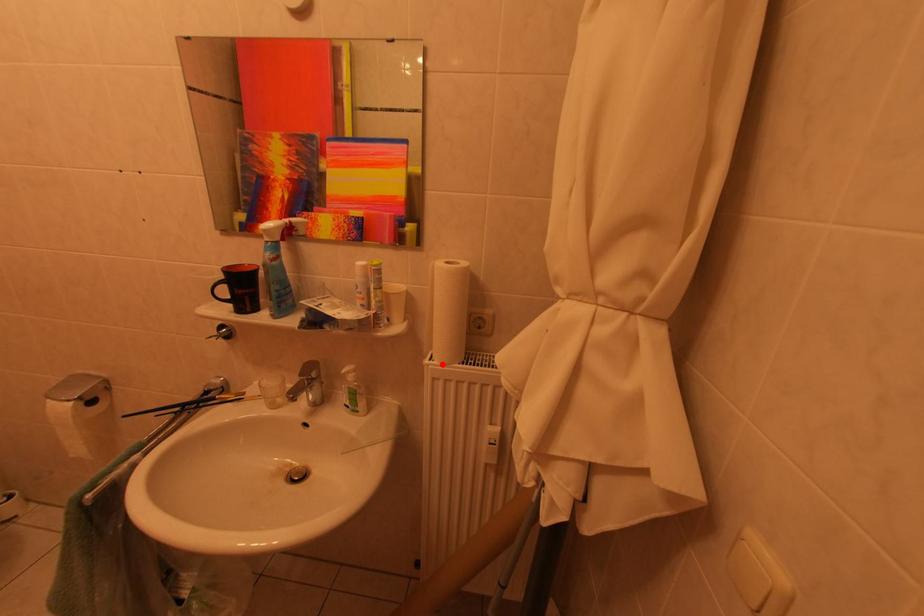
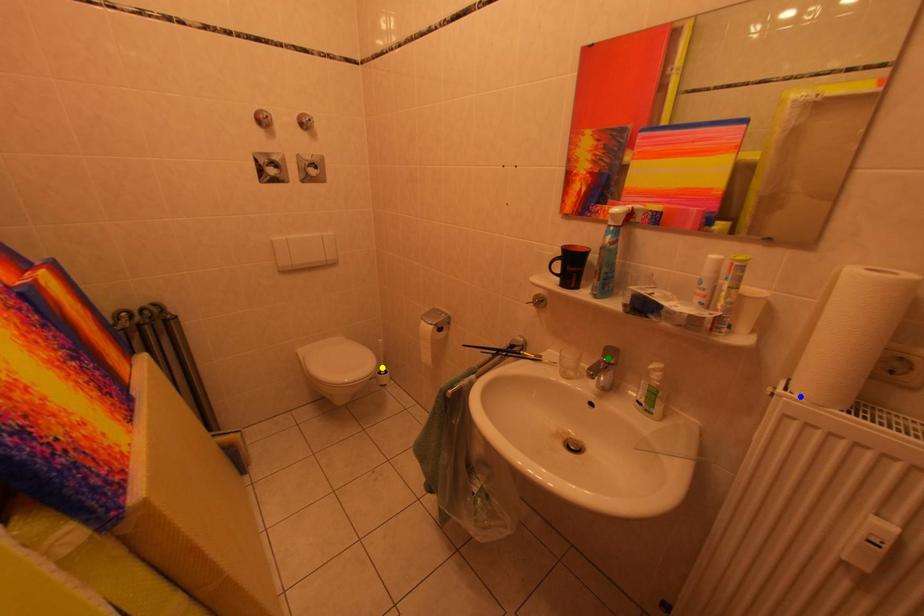
Question: I am providing you with two images of the same scene from different viewpoints. A red point is marked on the first image. You are given multiple points on the second image. Which point in image 2 is actually the same real-world point as the red point in image 1?

Choices:
 (A) green point
 (B) yellow point
 (C) blue point

Answer: (C)